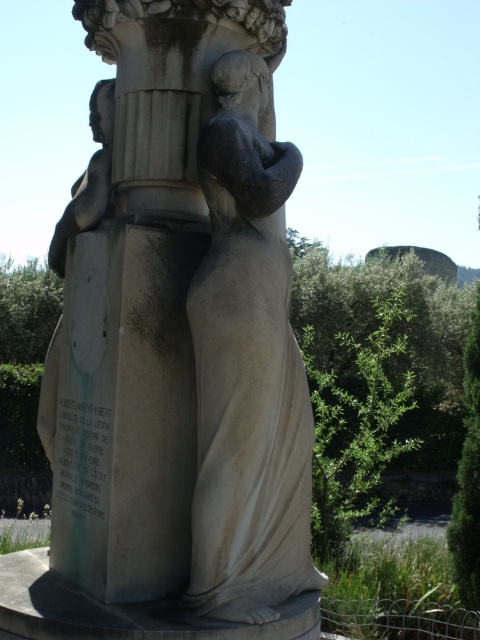
Is white marble statue at center below matte stone statue at center?

No.

Which is behind, point (148, 310) or point (211, 272)?

The point (148, 310) is more distant.

The image size is (480, 640). What do you see at coordinates (180, 323) in the screenshot? I see `white marble statue at center` at bounding box center [180, 323].

Where is `white marble statue at center`? Image resolution: width=480 pixels, height=640 pixels. white marble statue at center is located at coordinates (180, 323).

From the picture: Is matte stone statue at center wider than matte stone bust at upper left?

Yes.

Who is more distant from viewer, (x=226, y=273) or (x=75, y=221)?

Positioned behind is point (x=75, y=221).

You are a GUI agent. You are given a task and a screenshot of the screen. Output one action in this format:
    pyautogui.click(x=<x>, y=<y>)
    Task: Click on the matte stone statue at center
    This screenshot has height=640, width=480.
    Given the screenshot: What is the action you would take?
    pyautogui.click(x=248, y=368)

Who is positioned more to the right, white marble statue at center or matte stone bust at upper left?

white marble statue at center is more to the right.

Can you confirm if white marble statue at center is shorter than matte stone bust at upper left?

In fact, white marble statue at center may be taller than matte stone bust at upper left.

This screenshot has width=480, height=640. What do you see at coordinates (180, 323) in the screenshot?
I see `white marble statue at center` at bounding box center [180, 323].

At what (x,y) coordinates should I click in order to perform the action: click on white marble statue at center. Please return your answer as a coordinate pair (x, y). The image size is (480, 640). Looking at the image, I should click on (180, 323).